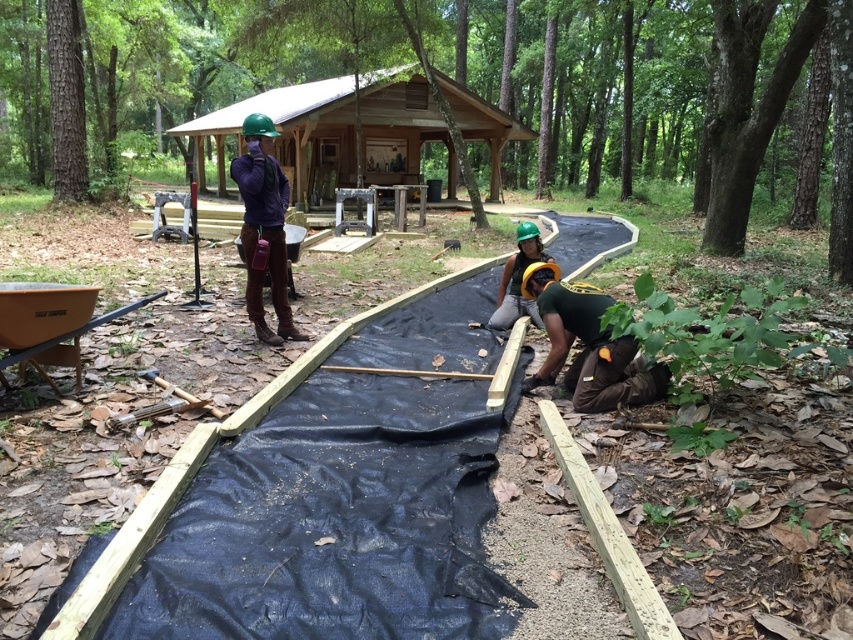
You are a safety inspector standing at the position of the viewer. You need to check the safety of the green matte helmet at lower right. Can you reach it within 4 meters without moving any objects?

The green matte helmet at lower right and viewer are 3.69 meters apart, so yes, you can reach it within 4 meters without moving any objects.

You are a safety inspector checking the construction site. You notice the black plastic sheeting at center and the matte purple shirt at upper center. Which object is larger in size?

The black plastic sheeting at center is bigger than the matte purple shirt at upper center.